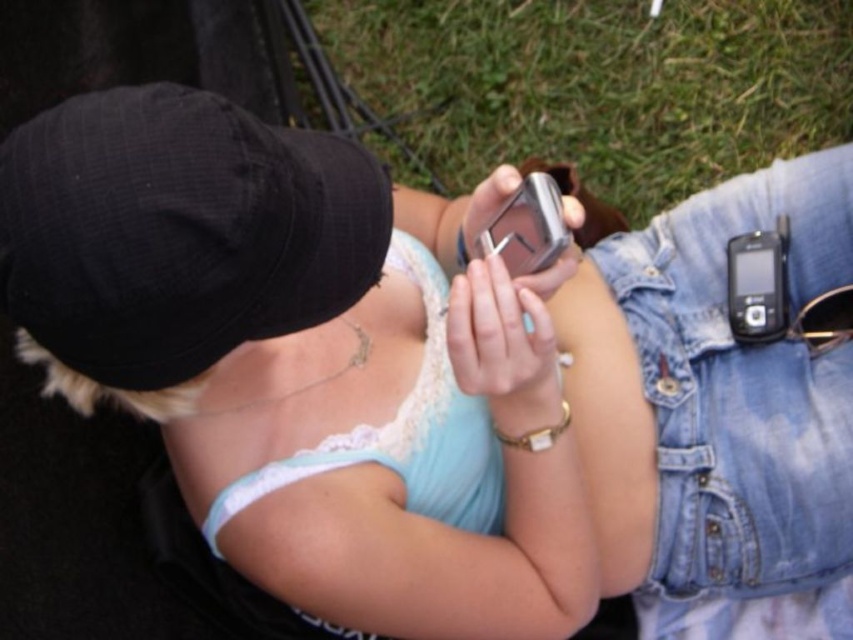
You are a photographer taking a picture of the scene. You notice the black fabric baseball cap at upper left and the green grass at center. Which object is positioned lower in the image?

The black fabric baseball cap at upper left is located below green grass at center, so it is positioned lower in the image.

You are a delivery drone that needs to hover above the green grass at center to drop off a package. The drone has a minimum safe hover height of 40 inches to avoid obstacles. Can you safely hover at the required height without hitting the silver metallic phone at center?

The distance between the green grass at center and the silver metallic phone at center is 38.25 inches. Since the drone needs to hover at 40 inches, which is higher than the distance to the phone, it can safely hover at the required height without hitting the silver metallic phone at center.

You are a fashion designer analyzing the outfit of the person in the image. Which item is smaller in size between the black fabric baseball cap at upper left and the denim at right?

The black fabric baseball cap at upper left has a smaller size compared to denim at right.